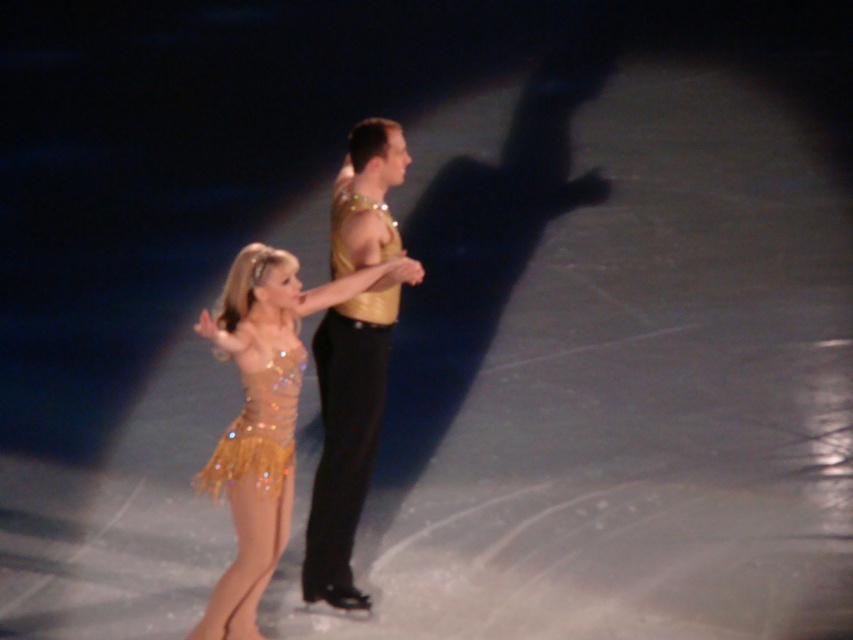
Question: Can you confirm if sparkly gold dress at center is positioned below gold shiny suit at center?

Choices:
 (A) yes
 (B) no

Answer: (A)

Question: Based on their relative distances, which object is nearer to the gold sequined dress at center?

Choices:
 (A) gold shiny suit at center
 (B) sparkly gold dress at center

Answer: (B)

Question: Is sparkly gold dress at center below gold sequined dress at center?

Choices:
 (A) yes
 (B) no

Answer: (A)

Question: Which object is the farthest from the gold sequined dress at center?

Choices:
 (A) sparkly gold dress at center
 (B) gold shiny suit at center

Answer: (B)

Question: Which object appears farthest from the camera in this image?

Choices:
 (A) gold shiny suit at center
 (B) gold sequined dress at center
 (C) sparkly gold dress at center

Answer: (A)

Question: Does sparkly gold dress at center appear over gold shiny suit at center?

Choices:
 (A) no
 (B) yes

Answer: (A)